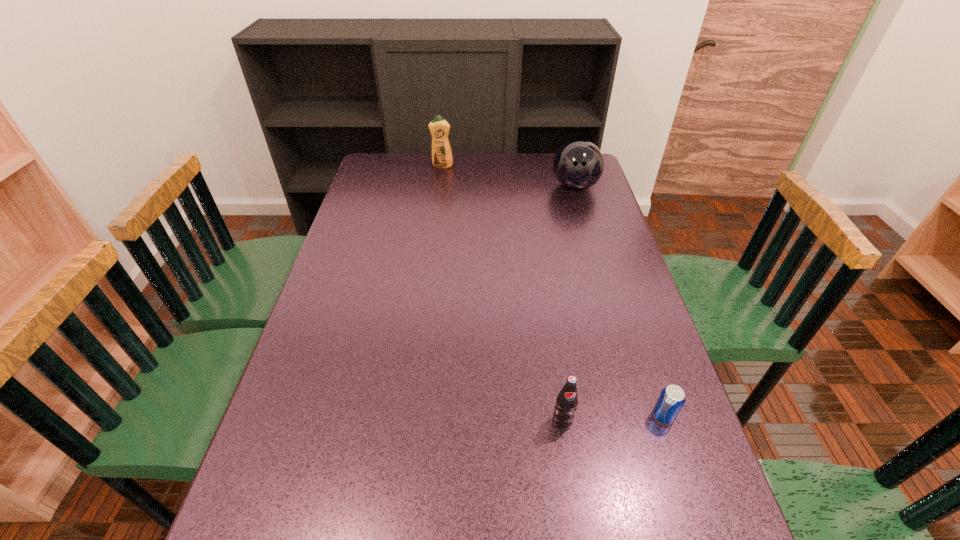
Where is `detergent`? This screenshot has width=960, height=540. detergent is located at coordinates (439, 128).

You are a GUI agent. You are given a task and a screenshot of the screen. Output one action in this format:
    pyautogui.click(x=<x>, y=<y>)
    Task: Click on the leftmost object
    The image size is (960, 540).
    Given the screenshot: What is the action you would take?
    pyautogui.click(x=439, y=128)

Identify the location of bowling ball. (578, 165).

You are a GUI agent. You are given a task and a screenshot of the screen. Output one action in this format:
    pyautogui.click(x=<x>, y=<y>)
    Task: Click on the pop
    This screenshot has height=540, width=960.
    Given the screenshot: What is the action you would take?
    pyautogui.click(x=566, y=404)

Locate an element on the screen. The width and height of the screenshot is (960, 540). the third object from right to left is located at coordinates (566, 404).

Identify the location of beer can. (672, 398).

Image resolution: width=960 pixels, height=540 pixels. Find the location of `free region located on the label of the detergent`. free region located on the label of the detergent is located at coordinates (441, 176).

Where is `vacant space located 0.270m on the side of the third nearest object with the finger holes`? vacant space located 0.270m on the side of the third nearest object with the finger holes is located at coordinates (593, 250).

Where is `free space located 0.090m on the front label of the second shortest object`? free space located 0.090m on the front label of the second shortest object is located at coordinates (570, 474).

The height and width of the screenshot is (540, 960). What are the coordinates of `free region located 0.300m on the back of the beer can` in the screenshot? It's located at (627, 306).